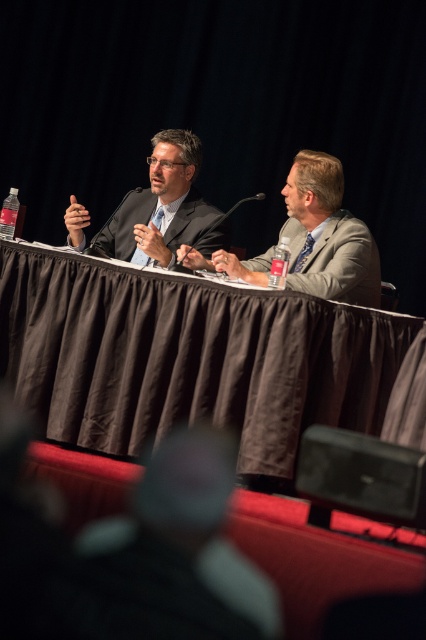
Question: Is brown fabric table at center positioned behind black plastic speaker at lower right?

Choices:
 (A) no
 (B) yes

Answer: (B)

Question: Which point appears farthest from the camera in this image?

Choices:
 (A) (212, 227)
 (B) (189, 227)
 (C) (103, 227)

Answer: (C)

Question: Which point is closer to the camera taking this photo?

Choices:
 (A) (187, 252)
 (B) (310, 461)
 (C) (101, 243)

Answer: (B)

Question: Is black plastic speaker at lower right to the right of matte black microphone at center from the viewer's perspective?

Choices:
 (A) no
 (B) yes

Answer: (B)

Question: Which is nearer to the black plastic microphone at center?

Choices:
 (A) brown fabric table at center
 (B) matte black suit at center

Answer: (B)

Question: Is brown fabric table at center smaller than black plastic speaker at lower right?

Choices:
 (A) yes
 (B) no

Answer: (B)